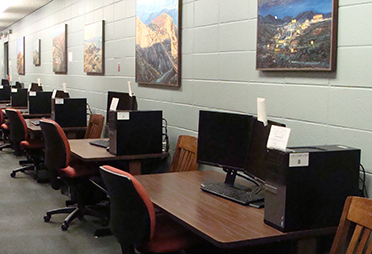
At what (x,y) coordinates should I click in order to perform the action: click on painting. Please return your answer as a coordinate pair (x, y). The height and width of the screenshot is (254, 372). Looking at the image, I should click on (147, 51), (286, 50), (90, 63), (62, 64).